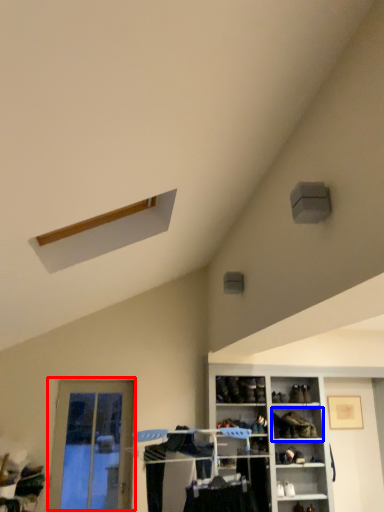
Question: Which object appears closest to the camera in this image, door (highlighted by a red box) or shelf (highlighted by a blue box)?

Choices:
 (A) door
 (B) shelf

Answer: (A)